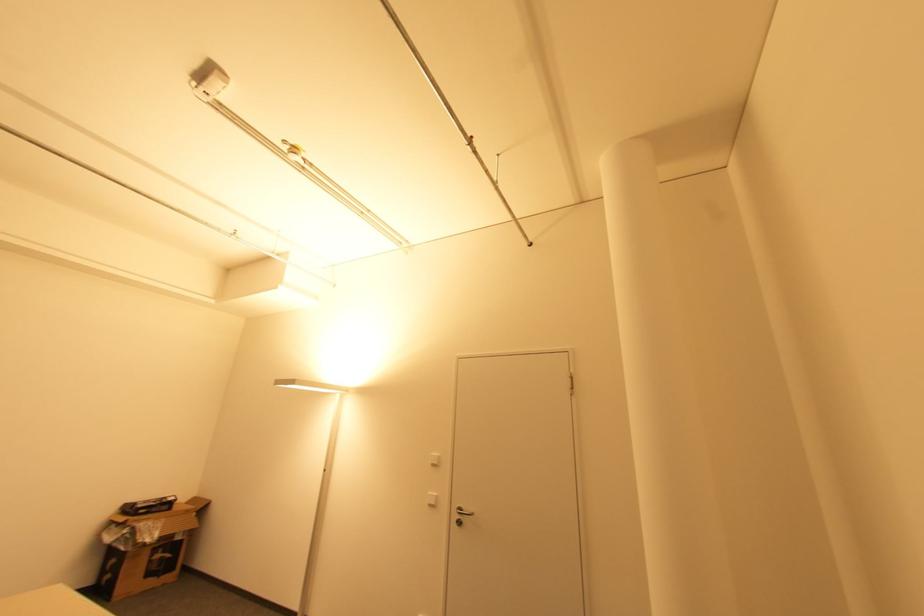
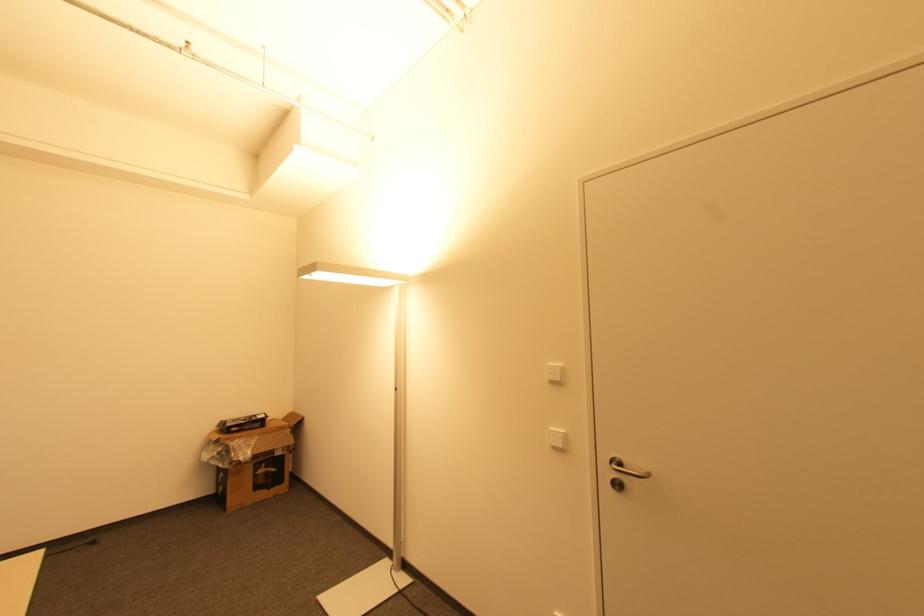
Question: What movement of the cameraman would produce the second image?

Choices:
 (A) Left
 (B) Right
 (C) Forward
 (D) Backward

Answer: (C)